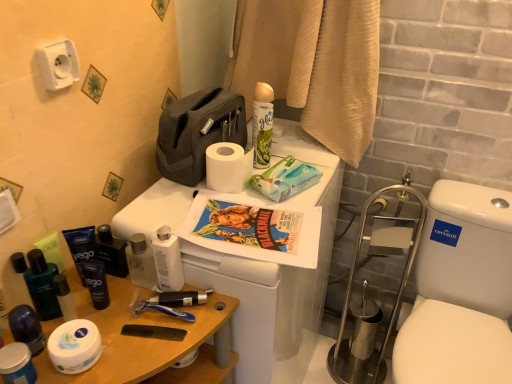
Where is `free space above wooden table at lower left (from a real-world perspective)`? Image resolution: width=512 pixels, height=384 pixels. free space above wooden table at lower left (from a real-world perspective) is located at coordinates (125, 327).